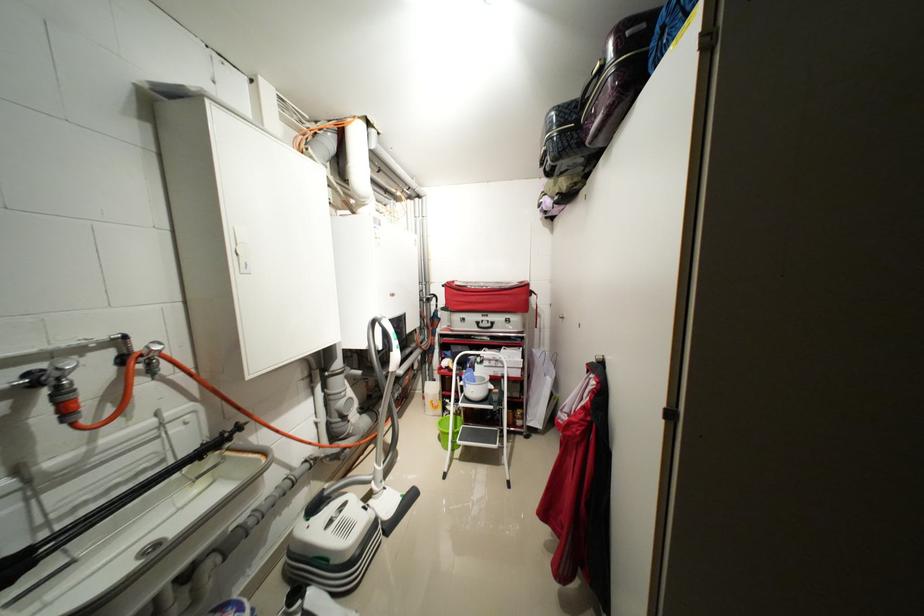
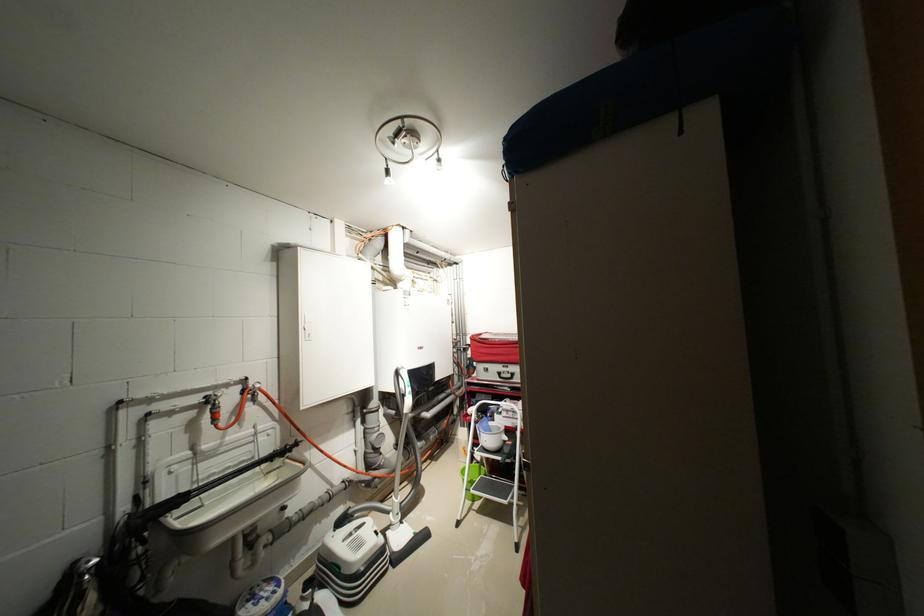
Locate, in the second image, the point that corresponds to point (51, 410) in the first image.

(214, 416)